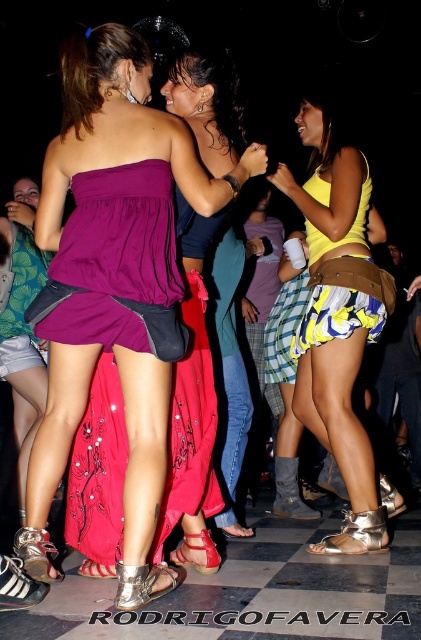
Between point (263, 164) and point (319, 332), which one is positioned in front?

Point (263, 164) is in front.

Between matte purple dress at center and yellow printed fabric skirt at center, which one has less height?

With less height is yellow printed fabric skirt at center.

Which is behind, point (175, 253) or point (322, 324)?

The point (322, 324) is behind.

The width and height of the screenshot is (421, 640). What are the coordinates of `matte purple dress at center` in the screenshot? It's located at (114, 284).

Who is positioned more to the right, matte purple dress at center or shiny purple dress at center?

shiny purple dress at center is more to the right.

Is point (149, 289) positioned in front of point (106, 532)?

Yes, it is in front of point (106, 532).

Image resolution: width=421 pixels, height=640 pixels. Find the location of `matte purple dress at center`. matte purple dress at center is located at coordinates (114, 284).

Does yellow matte tank top at center appear over yellow printed fabric skirt at center?

Actually, yellow matte tank top at center is below yellow printed fabric skirt at center.

Is yellow matte tank top at center behind yellow printed fabric skirt at center?

No, it is not.

The height and width of the screenshot is (640, 421). I want to click on yellow matte tank top at center, so click(338, 316).